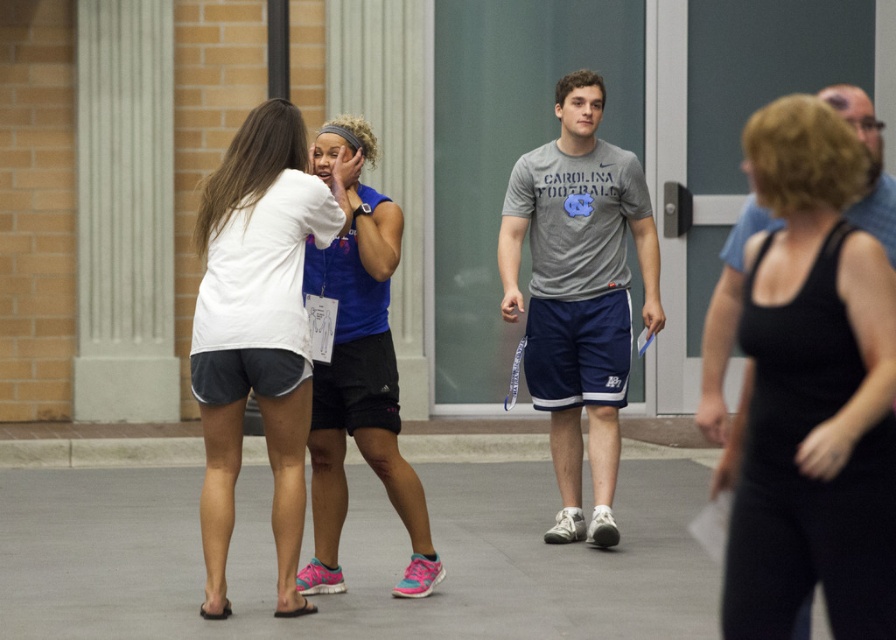
Can you confirm if white cotton shirt at center is thinner than blue athletic tank top at center?

No.

Which is more to the left, white cotton shirt at center or blue athletic tank top at center?

From the viewer's perspective, white cotton shirt at center appears more on the left side.

Describe the element at coordinates (257, 330) in the screenshot. I see `white cotton shirt at center` at that location.

Locate an element on the screen. white cotton shirt at center is located at coordinates (257, 330).

Based on the photo, between black tank top at center and gray cotton t-shirt at center, which one appears on the left side from the viewer's perspective?

gray cotton t-shirt at center

Is the position of black tank top at center more distant than that of gray cotton t-shirt at center?

No, black tank top at center is in front of gray cotton t-shirt at center.

Is point (755, 296) positioned behind point (582, 177)?

No, (755, 296) is closer to viewer.

Locate an element on the screen. black tank top at center is located at coordinates (811, 390).

Which is in front, point (217, 241) or point (527, 214)?

Point (217, 241) is in front.

Does white cotton shirt at center appear on the right side of gray cotton t-shirt at center?

In fact, white cotton shirt at center is to the left of gray cotton t-shirt at center.

Does point (304, 419) come behind point (554, 220)?

No, it is in front of (554, 220).

The height and width of the screenshot is (640, 896). In order to click on white cotton shirt at center in this screenshot , I will do `click(257, 330)`.